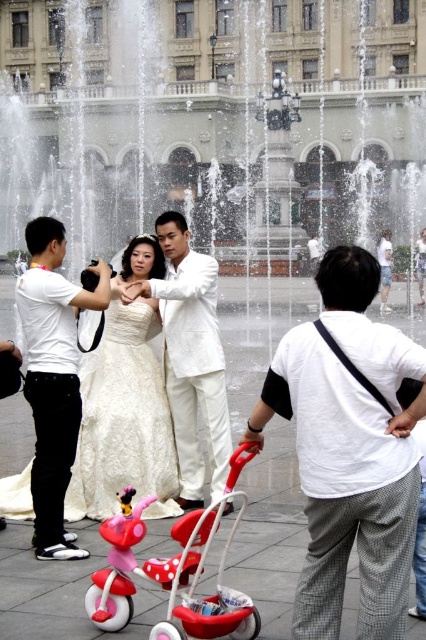
You are a photographer at the wedding and want to take a photo of the white matte shirt at left and the matte pink plastic baby carriage at center. Which object is positioned more to the left side of the scene?

The white matte shirt at left is positioned to the left of the matte pink plastic baby carriage at center, so the white matte shirt at left is more to the left side of the scene.

You are a photographer at the wedding and you need to capture a photo of the white cotton shirt at center and the matte pink plastic baby carriage at center. Which one is on the right side when looking at the scene?

The white cotton shirt at center is positioned on the right side of the matte pink plastic baby carriage at center, so the white cotton shirt at center is on the right side.

From the picture: You are a photographer planning to take a group photo of the white matte suit at center and the matte pink plastic baby carriage at center. Which object should you focus on first if you want to ensure both are in focus, considering their sizes?

The white matte suit at center is larger in size compared to the matte pink plastic baby carriage at center, so you should focus on the white matte suit at center first to ensure both are in focus.